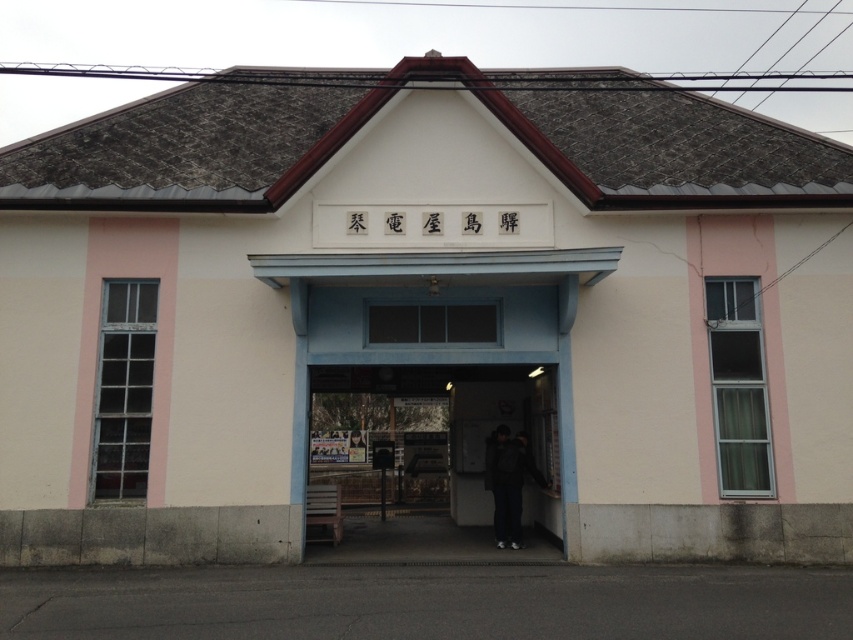
Can you confirm if matte concrete entrance at center is positioned to the left of dark gray concrete entrance at center?

Yes, matte concrete entrance at center is to the left of dark gray concrete entrance at center.

Which is more to the left, matte concrete entrance at center or dark gray concrete entrance at center?

matte concrete entrance at center

The height and width of the screenshot is (640, 853). I want to click on matte concrete entrance at center, so click(457, 429).

Identify the location of matte concrete entrance at center. pyautogui.click(x=457, y=429).

Is dark gray concrete entrance at center thinner than dark gray jacket at center?

Incorrect, dark gray concrete entrance at center's width is not less than dark gray jacket at center's.

Does dark gray concrete entrance at center lie in front of dark gray jacket at center?

That is False.

Identify the location of dark gray concrete entrance at center. (480, 440).

The width and height of the screenshot is (853, 640). Describe the element at coordinates (457, 429) in the screenshot. I see `matte concrete entrance at center` at that location.

Identify the location of matte concrete entrance at center. Image resolution: width=853 pixels, height=640 pixels. (457, 429).

Image resolution: width=853 pixels, height=640 pixels. In order to click on matte concrete entrance at center in this screenshot , I will do `click(457, 429)`.